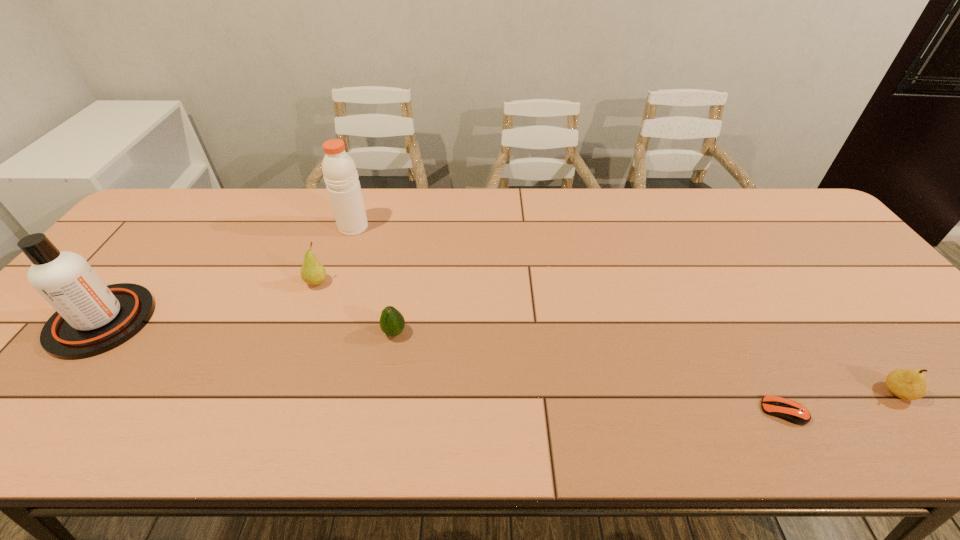
The width and height of the screenshot is (960, 540). I want to click on object positioned at the near right corner, so click(906, 384).

The width and height of the screenshot is (960, 540). What are the coordinates of `free space at the far edge of the desktop` in the screenshot? It's located at (401, 214).

Locate an element on the screen. The image size is (960, 540). vacant space at the left edge is located at coordinates (104, 272).

At what (x,y) coordinates should I click in order to perform the action: click on vacant space at the right edge of the desktop. Please return your answer as a coordinate pair (x, y). Looking at the image, I should click on (809, 266).

The width and height of the screenshot is (960, 540). In the image, there is a desktop. Identify the location of vacant space at the far left corner. (216, 188).

Image resolution: width=960 pixels, height=540 pixels. In the image, there is a desktop. What are the coordinates of `vacant area at the far right corner` in the screenshot? It's located at (772, 209).

Identify the location of free space between the shorter pear and the fourth object from left to right. pyautogui.click(x=646, y=362).

Locate an element on the screen. The width and height of the screenshot is (960, 540). vacant area between the second object from right to left and the fourth shortest object is located at coordinates (550, 347).

This screenshot has height=540, width=960. Find the location of `free space between the second object from right to left and the fourth shortest object`. free space between the second object from right to left and the fourth shortest object is located at coordinates (550, 347).

Locate an element on the screen. This screenshot has width=960, height=540. free space between the third tallest object and the fifth object from left to right is located at coordinates (550, 347).